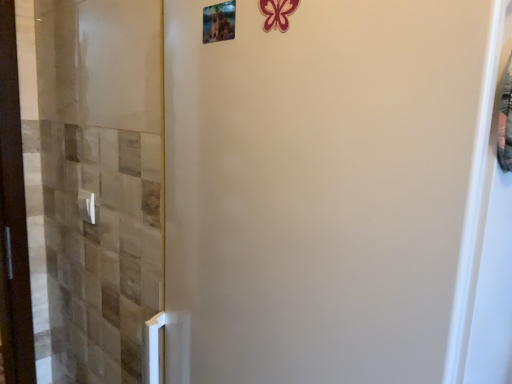
Question: Is white plastic door handle at lower left facing towards metallic photo frame at upper center?

Choices:
 (A) yes
 (B) no

Answer: (B)

Question: Considering the relative positions of white plastic door handle at lower left and metallic photo frame at upper center in the image provided, is white plastic door handle at lower left to the right of metallic photo frame at upper center from the viewer's perspective?

Choices:
 (A) yes
 (B) no

Answer: (B)

Question: Is white plastic door handle at lower left positioned with its back to metallic photo frame at upper center?

Choices:
 (A) no
 (B) yes

Answer: (A)

Question: Considering the relative sizes of white plastic door handle at lower left and metallic photo frame at upper center in the image provided, is white plastic door handle at lower left smaller than metallic photo frame at upper center?

Choices:
 (A) yes
 (B) no

Answer: (B)

Question: Is white plastic door handle at lower left positioned beyond the bounds of metallic photo frame at upper center?

Choices:
 (A) no
 (B) yes

Answer: (B)

Question: From the image's perspective, is white plastic door handle at lower left below metallic photo frame at upper center?

Choices:
 (A) yes
 (B) no

Answer: (A)

Question: Could white plastic door handle at lower left be considered to be inside metallic photo frame at upper center?

Choices:
 (A) no
 (B) yes

Answer: (A)

Question: Can you confirm if metallic photo frame at upper center is positioned to the right of white plastic door handle at lower left?

Choices:
 (A) yes
 (B) no

Answer: (A)

Question: Is metallic photo frame at upper center behind white plastic door handle at lower left?

Choices:
 (A) yes
 (B) no

Answer: (B)

Question: Is metallic photo frame at upper center thinner than white plastic door handle at lower left?

Choices:
 (A) no
 (B) yes

Answer: (B)

Question: Can you confirm if metallic photo frame at upper center is positioned to the left of white plastic door handle at lower left?

Choices:
 (A) yes
 (B) no

Answer: (B)

Question: Is metallic photo frame at upper center positioned beyond the bounds of white plastic door handle at lower left?

Choices:
 (A) yes
 (B) no

Answer: (A)

Question: In the image, is metallic photo frame at upper center positioned in front of or behind white plastic door handle at lower left?

Choices:
 (A) behind
 (B) front

Answer: (B)